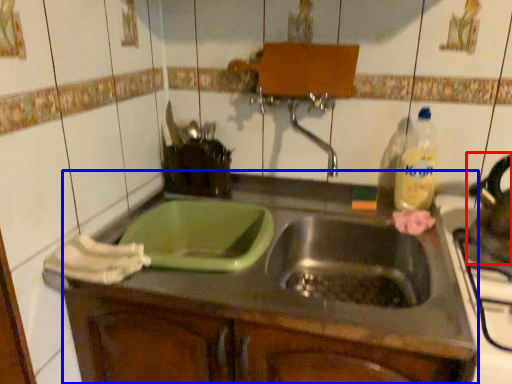
Question: Which of the following is the closest to the observer, tea pot (highlighted by a red box) or countertop (highlighted by a blue box)?

Choices:
 (A) tea pot
 (B) countertop

Answer: (B)